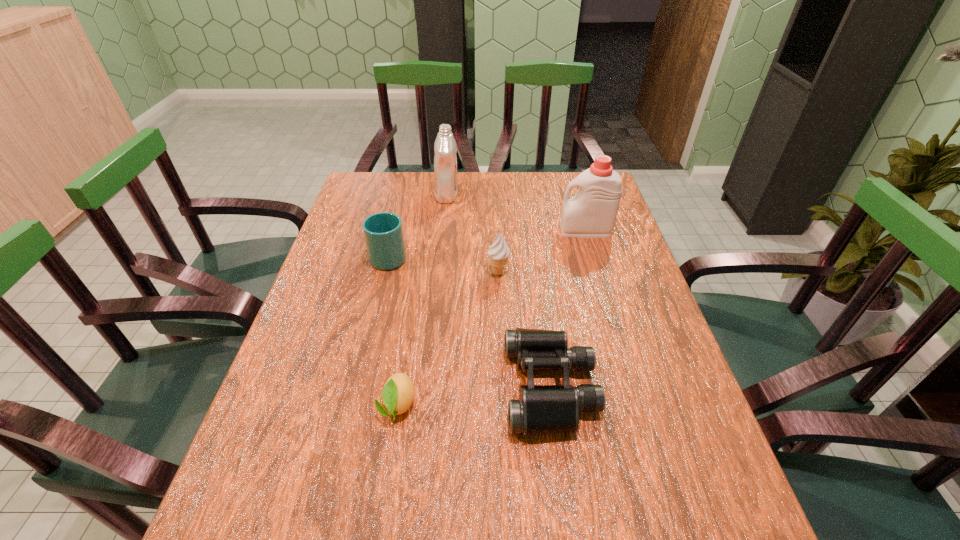
At what (x,y) coordinates should I click in order to perform the action: click on free location located on the front-facing side of the fifth tallest object. Please return your answer as a coordinate pair (x, y). Image resolution: width=960 pixels, height=540 pixels. Looking at the image, I should click on (322, 387).

Find the location of a particular element. This screenshot has height=540, width=960. vacant position located with leaves positioned above the lemon is located at coordinates (378, 524).

Where is `object present at the far edge`? The width and height of the screenshot is (960, 540). object present at the far edge is located at coordinates (445, 160).

Locate an element on the screen. This screenshot has width=960, height=540. object situated at the left edge is located at coordinates (383, 232).

Locate an element on the screen. object that is at the right edge is located at coordinates (591, 213).

This screenshot has height=540, width=960. Identify the location of free space at the far edge of the desktop. (551, 201).

What are the coordinates of `blank space at the left edge of the desktop` in the screenshot? It's located at (324, 325).

In order to click on vacant space at the right edge of the desktop in this screenshot , I will do `click(736, 518)`.

Where is `vacant space at the far left corner of the desktop`? vacant space at the far left corner of the desktop is located at coordinates (394, 183).

At what (x,y) coordinates should I click in order to perform the action: click on vacant space in between the right detergent and the shortest object. Please return your answer as a coordinate pair (x, y). Looking at the image, I should click on tap(492, 318).